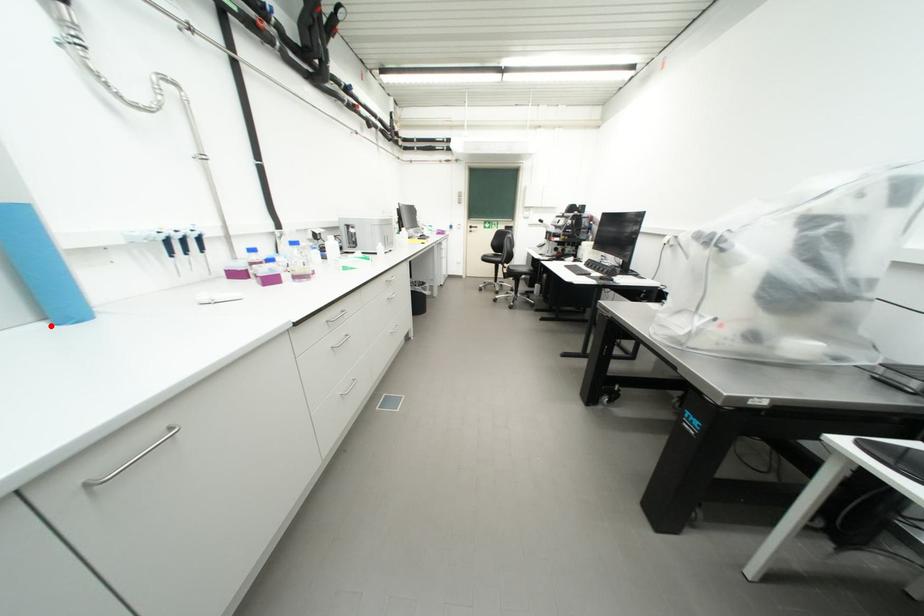
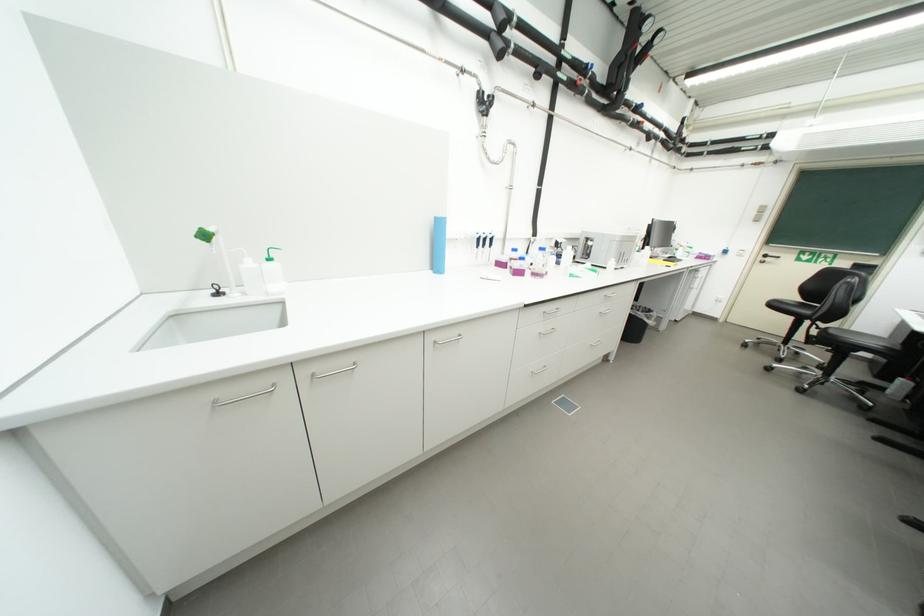
Question: I am providing you with two images of the same scene from different viewpoints. A red point is marked on the first image. Can you still see the location of the red point in image 2?

Choices:
 (A) Yes
 (B) No

Answer: (A)